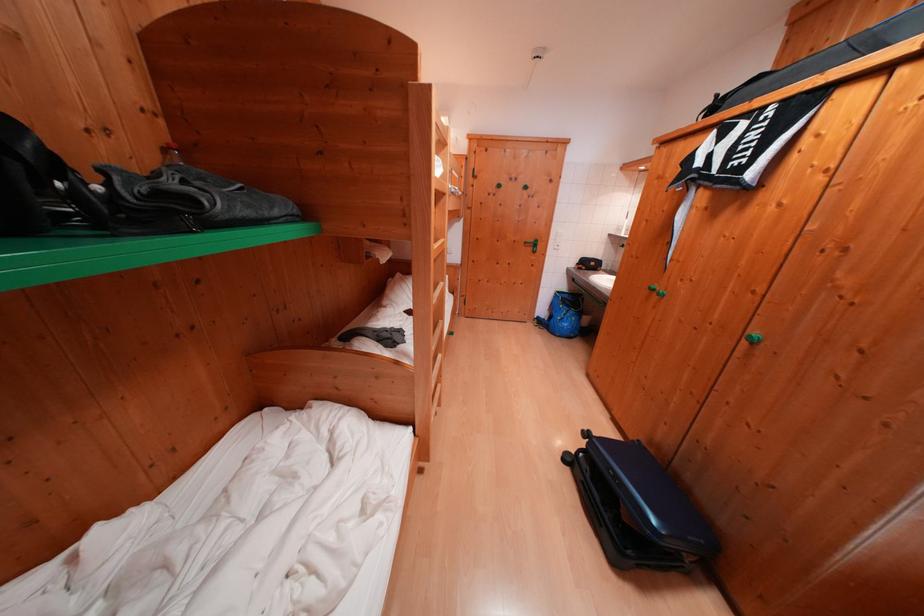
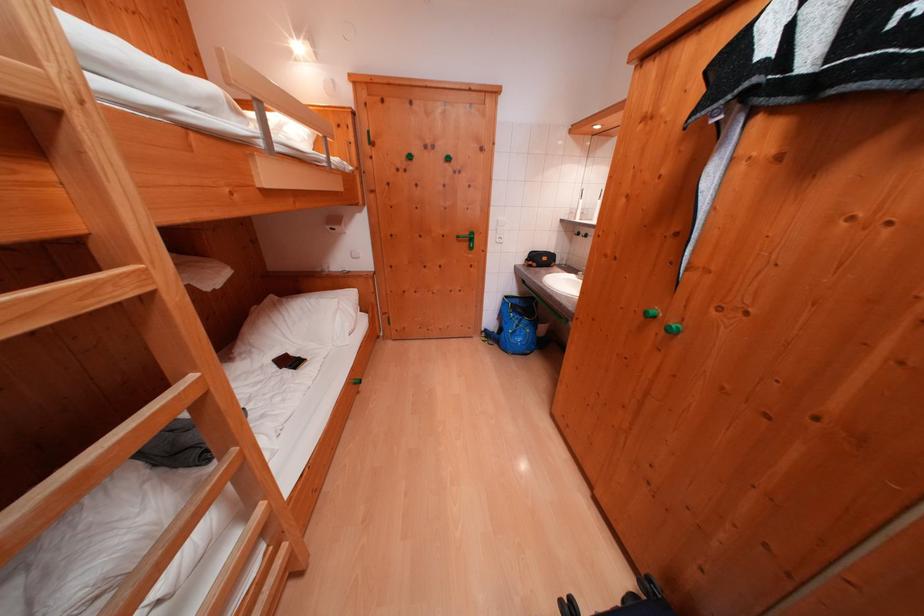
Find the pixel in the second image that matches (x=565, y=296) in the first image.

(515, 301)